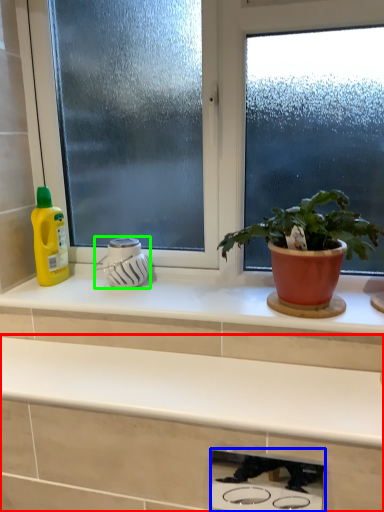
Question: Which object is positioned closest to countertop (highlighted by a red box)? Select from appliance (highlighted by a blue box) and appliance (highlighted by a green box).

Choices:
 (A) appliance
 (B) appliance

Answer: (B)